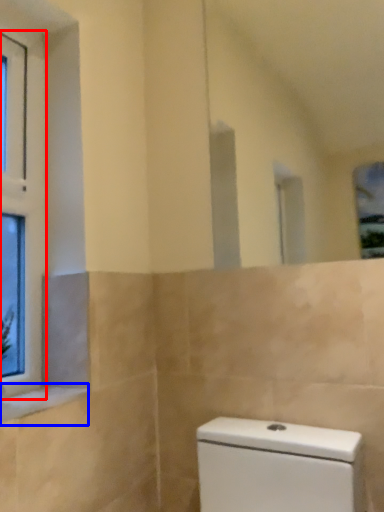
Question: Among these objects, which one is nearest to the camera, window (highlighted by a red box) or window sill (highlighted by a blue box)?

Choices:
 (A) window
 (B) window sill

Answer: (B)